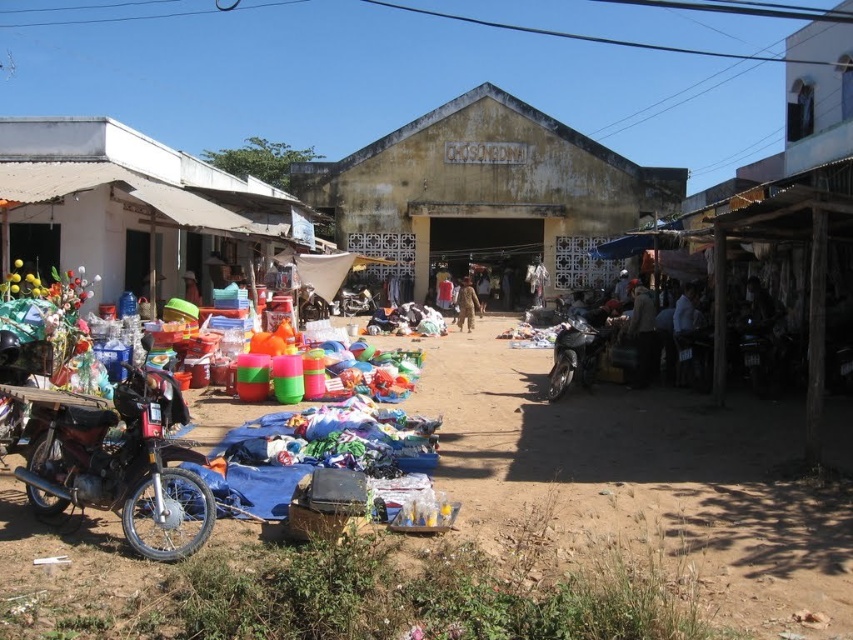
Question: Estimate the real-world distances between objects in this image. Which object is farther from the shiny metallic motorcycle at center?

Choices:
 (A) brown fabric person at center
 (B) shiny black motorcycle at left
 (C) brown dirt field at lower left
 (D) brown fabric jacket at center

Answer: (B)

Question: Is shiny black motorcycle at left positioned at the back of brown fabric person at center?

Choices:
 (A) yes
 (B) no

Answer: (B)

Question: Which of the following is the closest to the observer?

Choices:
 (A) (479, 195)
 (B) (7, 141)

Answer: (B)

Question: Estimate the real-world distances between objects in this image. Which object is closer to the brown fabric person at center?

Choices:
 (A) white corrugated metal hut at left
 (B) brown dirt field at lower left

Answer: (A)

Question: Is shiny black motorcycle at left to the left of brown fabric jacket at center from the viewer's perspective?

Choices:
 (A) yes
 (B) no

Answer: (A)

Question: Considering the relative positions of brown dirt field at lower left and yellowish concrete building at center in the image provided, where is brown dirt field at lower left located with respect to yellowish concrete building at center?

Choices:
 (A) left
 (B) right

Answer: (A)